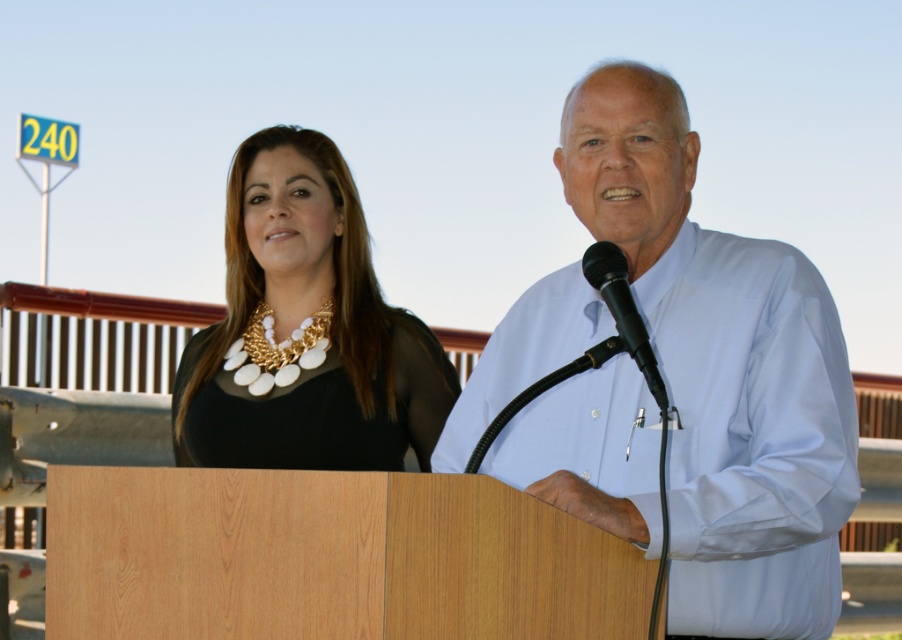
Question: Which object is closer to the camera taking this photo?

Choices:
 (A) black matte necklace at upper left
 (B) black matte microphone at center
 (C) light blue shirt at center

Answer: (B)

Question: Which object is closer to the camera taking this photo?

Choices:
 (A) black matte microphone at center
 (B) light blue shirt at center
 (C) black matte necklace at upper left

Answer: (A)

Question: Is black matte necklace at upper left to the left of black matte microphone at center from the viewer's perspective?

Choices:
 (A) yes
 (B) no

Answer: (A)

Question: In this image, where is black matte necklace at upper left located relative to black matte microphone at center?

Choices:
 (A) right
 (B) left

Answer: (B)

Question: Is black matte necklace at upper left to the left of black matte microphone at center from the viewer's perspective?

Choices:
 (A) no
 (B) yes

Answer: (B)

Question: Which object is the closest to the black matte microphone at center?

Choices:
 (A) light blue shirt at center
 (B) black matte necklace at upper left

Answer: (A)